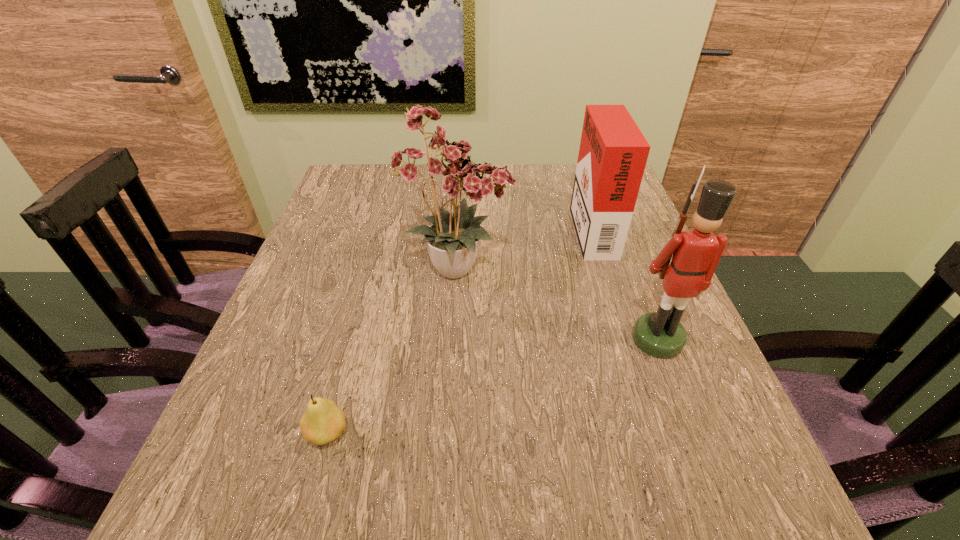
Find the location of `free space between the cigarette case and the nutcracker`. free space between the cigarette case and the nutcracker is located at coordinates (625, 283).

Find the location of a particular element. The height and width of the screenshot is (540, 960). free space between the shortest object and the third object from right to left is located at coordinates (394, 351).

The height and width of the screenshot is (540, 960). I want to click on free space between the flower arrangement and the nearest object, so click(394, 351).

Locate an element on the screen. empty location between the third object from right to left and the nutcracker is located at coordinates (558, 304).

This screenshot has height=540, width=960. What are the coordinates of `vacant region between the nutcracker and the second object from left to right` in the screenshot? It's located at (558, 304).

Locate an element on the screen. This screenshot has height=540, width=960. free spot between the second object from left to right and the cigarette case is located at coordinates pyautogui.click(x=525, y=248).

The width and height of the screenshot is (960, 540). What are the coordinates of `free spot between the nutcracker and the third tallest object` in the screenshot? It's located at (625, 283).

At what (x,y) coordinates should I click in order to perform the action: click on vacant point located between the nearest object and the third farthest object. Please return your answer as a coordinate pair (x, y). Looking at the image, I should click on (492, 386).

Locate an element on the screen. This screenshot has height=540, width=960. unoccupied position between the second shortest object and the second object from left to right is located at coordinates (525, 248).

I want to click on the third closest object to the pear, so click(x=613, y=152).